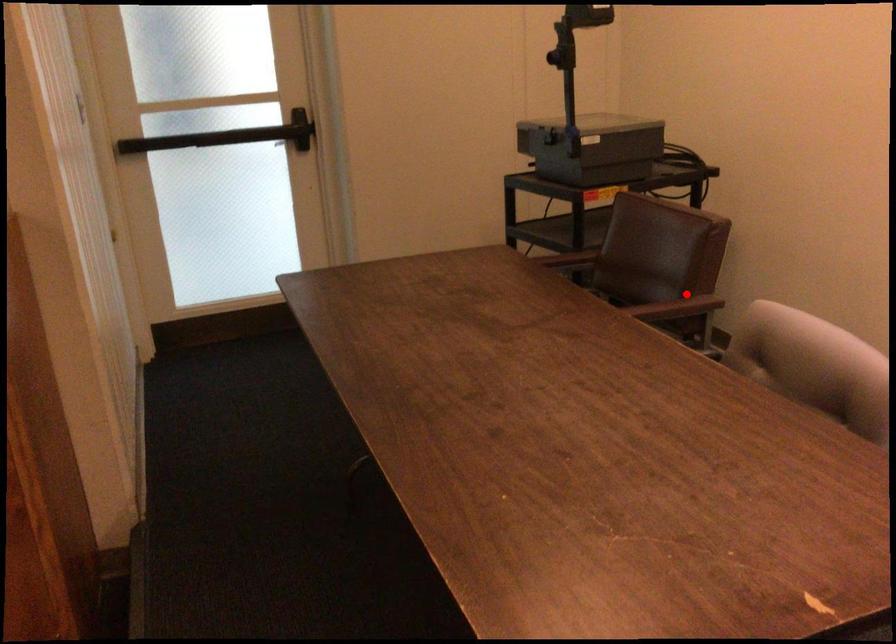
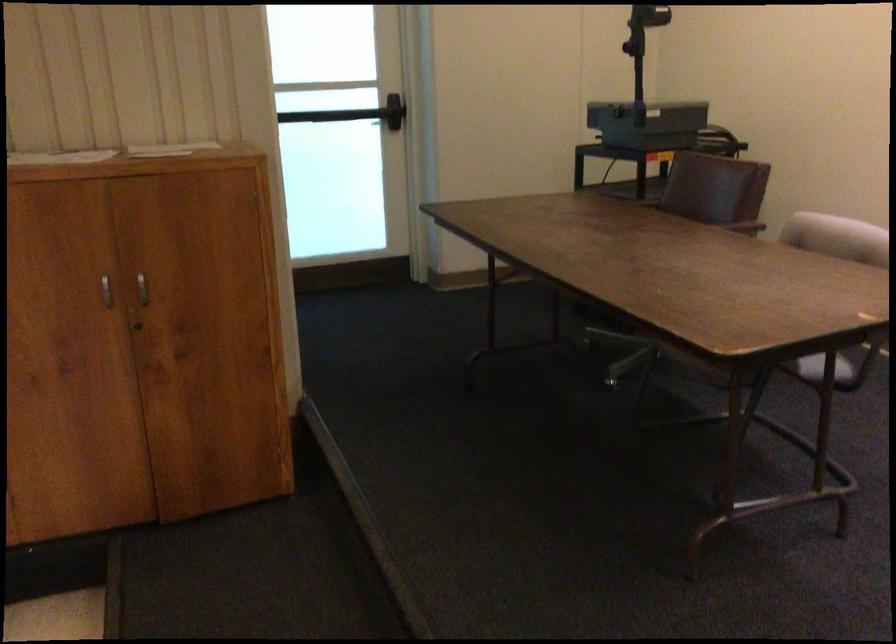
In the second image, find the point that corresponds to the highlighted location in the first image.

(739, 223)